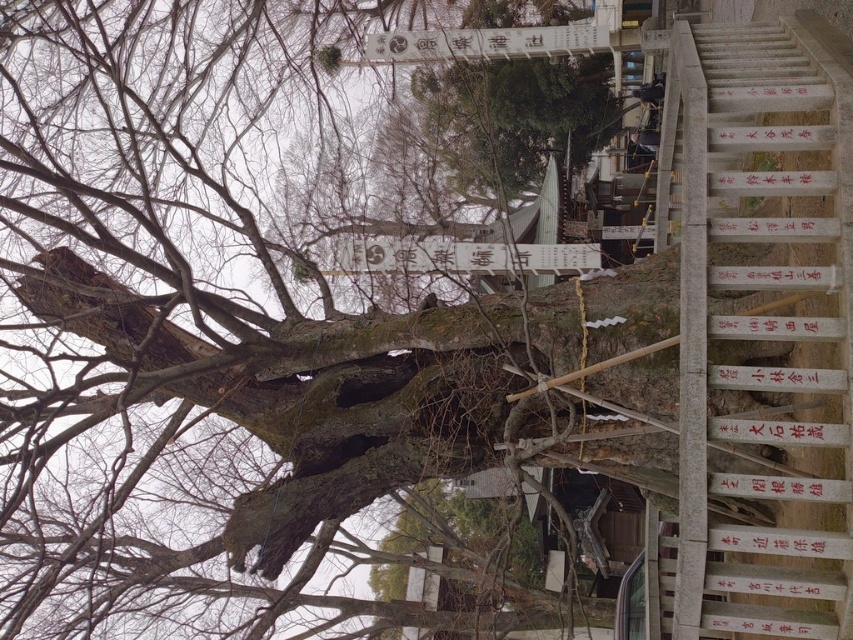
You are a visitor at the shrine and want to read both the white paper sign at center and the white wood sign at upper center. Which sign should you look at first if you want to read them in the order they are placed from left to right?

You should look at the white paper sign at center first because it is positioned to the left of the white wood sign at upper center, making it the leftmost sign in the left to right order.

You are a visitor at the shrine and want to read both the white paper sign at center and the white wood sign at upper center. If you are standing at the base of the large tree, which sign is closer to you?

The white paper sign at center is closer to you since it is only 8.41 feet away from the white wood sign at upper center, placing it nearer to your position at the base of the tree.

You are a visitor at the shrine and want to walk down the white stone stairs at right. Before stepping on them, you notice a white wood sign at upper center. Which object is wider in terms of their physical dimensions?

The white wood sign at upper center is wider than the white stone stairs at right.